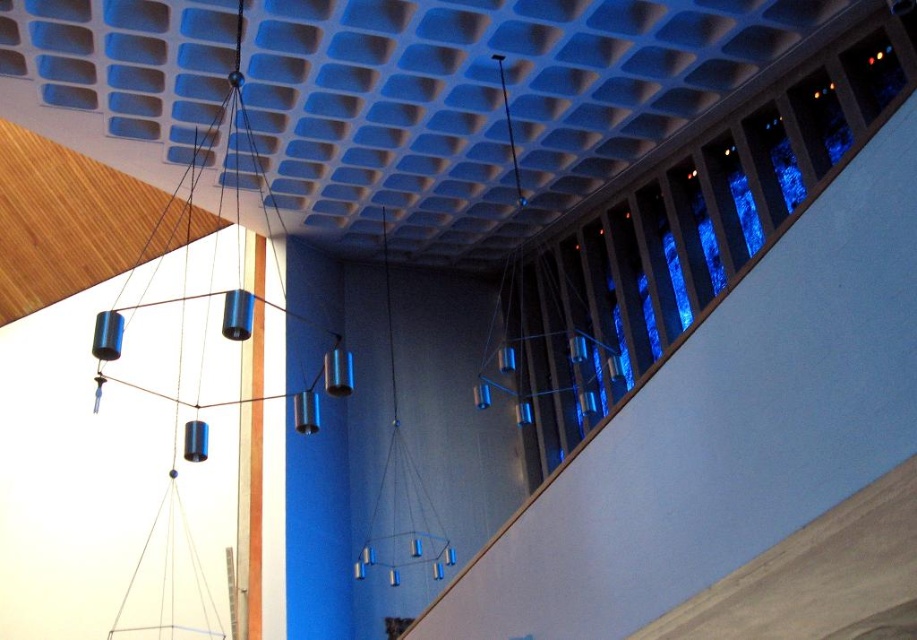
Consider the image. Does metallic blue hanging light at center have a lesser width compared to metallic cylinders at upper right?

No, metallic blue hanging light at center is not thinner than metallic cylinders at upper right.

Between metallic blue hanging light at center and metallic cylinders at upper right, which one is positioned higher?

Positioned higher is metallic cylinders at upper right.

Who is more forward, (x=401, y=481) or (x=507, y=93)?

Point (x=507, y=93) is in front.

At what (x,y) coordinates should I click in order to perform the action: click on metallic blue hanging light at center. Please return your answer as a coordinate pair (x, y). Looking at the image, I should click on (400, 474).